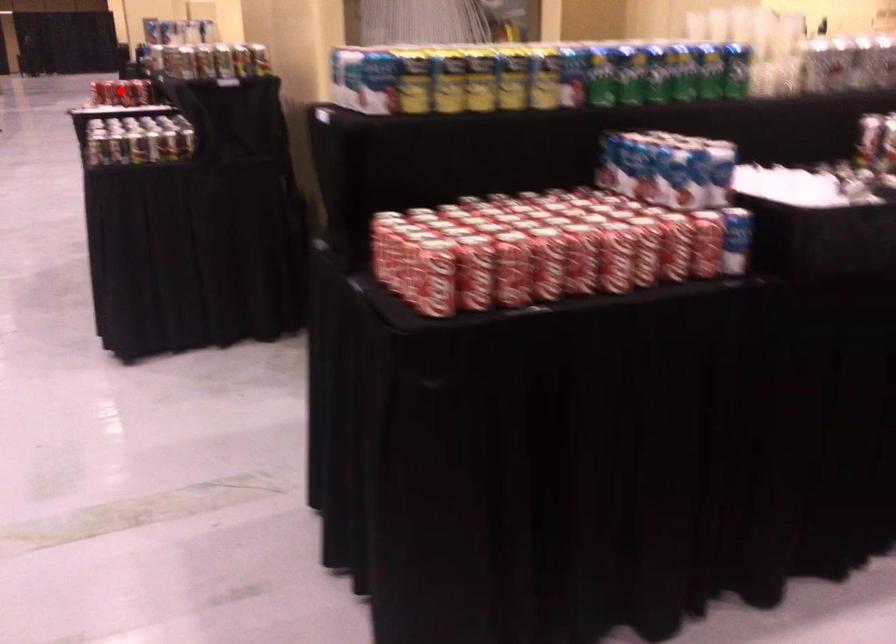
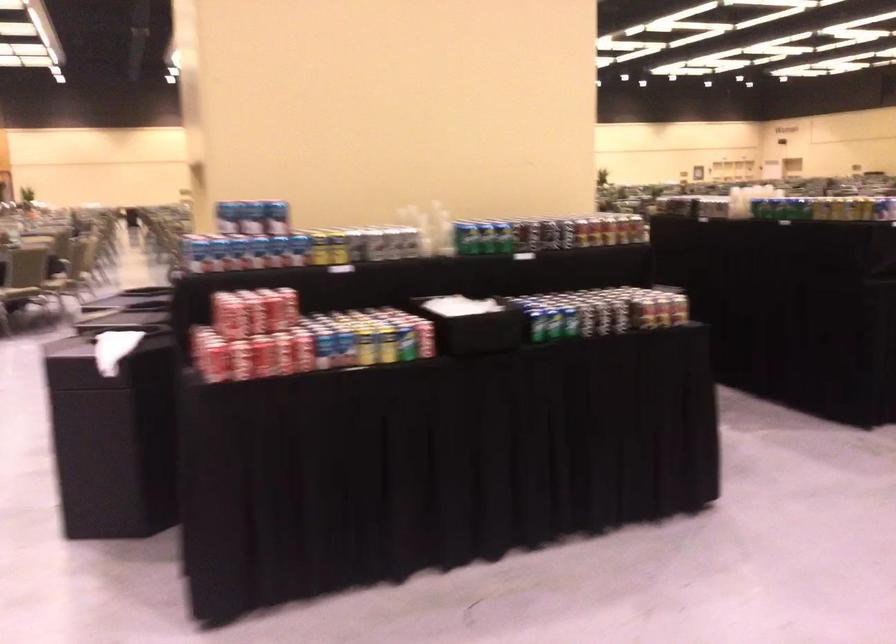
Question: I am providing you with two images of the same scene from different viewpoints. In image1, a red point is highlighted. Considering the same 3D point in image2, which of the following is correct?

Choices:
 (A) It is closer
 (B) It is farther

Answer: (A)